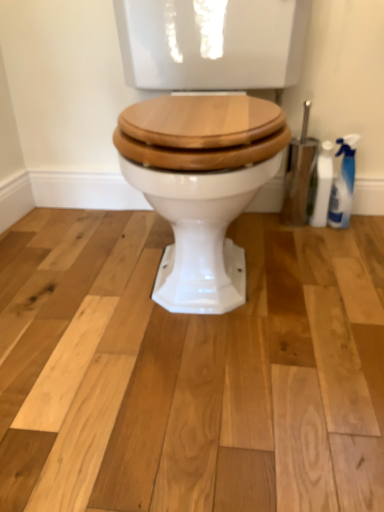
The image size is (384, 512). I want to click on vacant space that is to the left of white plastic spray bottle at right, arranged as the 1th cleaning product when viewed from the left, so click(x=265, y=233).